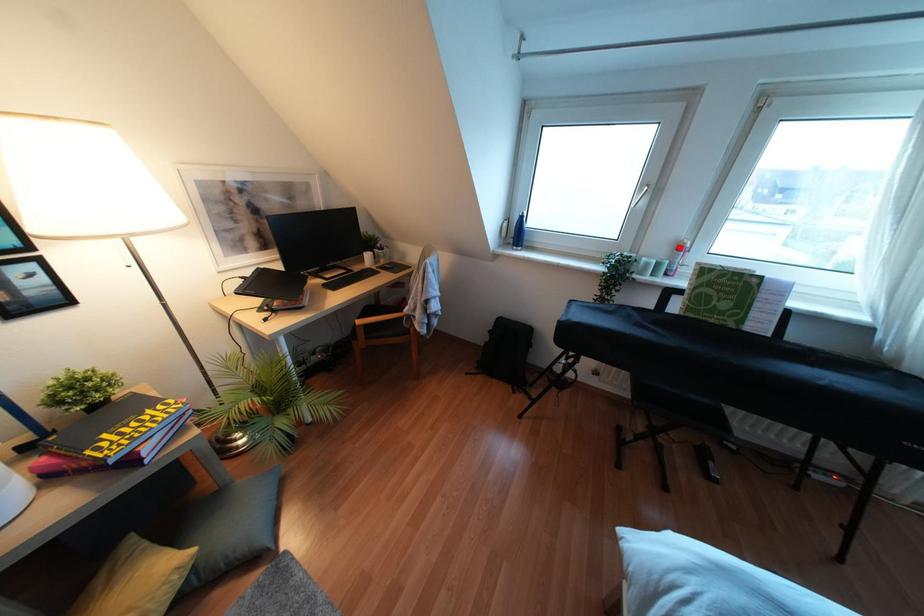
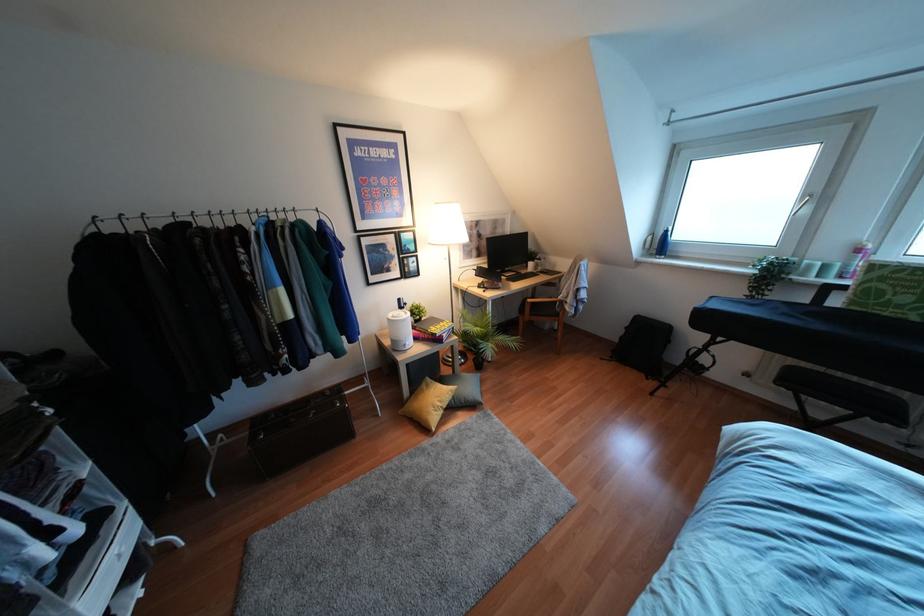
The point at the highlighted location is marked in the first image. Where is the corresponding point in the second image?

(858, 249)